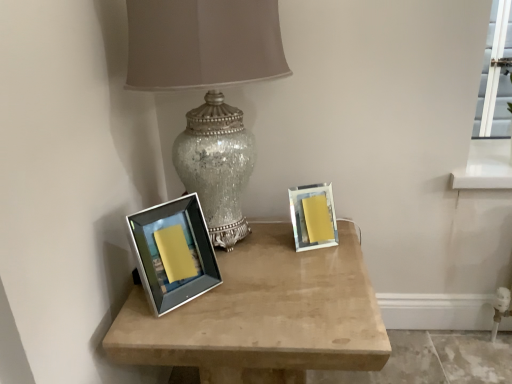
Image resolution: width=512 pixels, height=384 pixels. In order to click on free space in front of matte silver picture frame at right, which appears as the 2th picture frame when viewed from the left in this screenshot , I will do `click(313, 271)`.